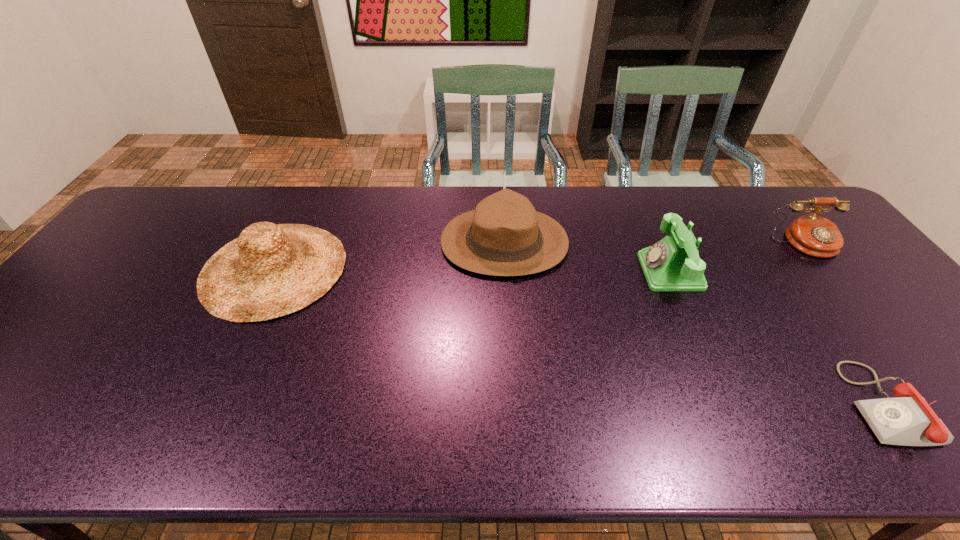
Where is `the fourth object from right to left`? This screenshot has height=540, width=960. the fourth object from right to left is located at coordinates (504, 236).

This screenshot has width=960, height=540. Find the location of `fedora`. fedora is located at coordinates (504, 236).

Locate an element on the screen. Image resolution: width=960 pixels, height=540 pixels. the leftmost telephone is located at coordinates (672, 264).

Where is `the leftmost object`? the leftmost object is located at coordinates (270, 270).

At what (x,y) coordinates should I click in order to perform the action: click on the second tallest telephone. Please return your answer as a coordinate pair (x, y). The width and height of the screenshot is (960, 540). Looking at the image, I should click on (813, 235).

Where is `vacant region located on the feather side of the fedora`? vacant region located on the feather side of the fedora is located at coordinates tap(355, 242).

This screenshot has width=960, height=540. In order to click on vacant space situated on the feather side of the fedora in this screenshot , I will do `click(395, 242)`.

This screenshot has height=540, width=960. I want to click on vacant space located 0.100m on the feather side of the fedora, so click(x=408, y=242).

Where is `free location located 0.320m on the dial of the third object from right to left`? The width and height of the screenshot is (960, 540). free location located 0.320m on the dial of the third object from right to left is located at coordinates point(529,272).

Locate an element on the screen. Image resolution: width=960 pixels, height=540 pixels. vacant space located on the dial of the third object from right to left is located at coordinates (586, 272).